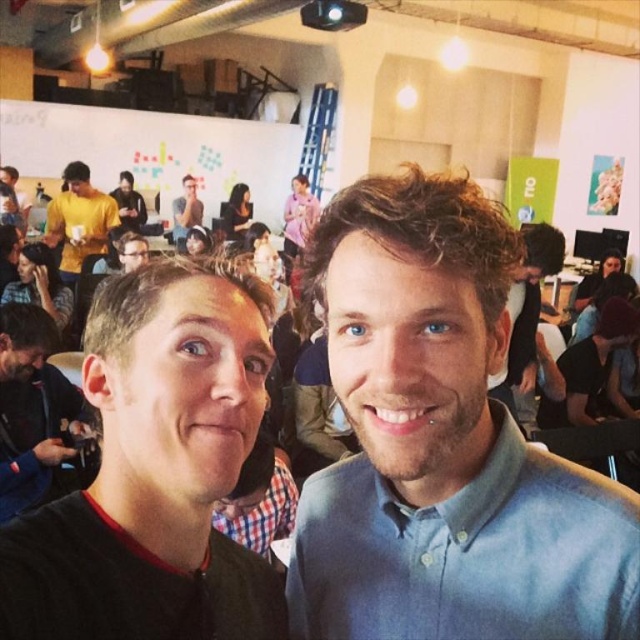
You are a photographer in the workshop and want to capture a photo of the black matte shirt at center and the matte gray shirt at upper center. Which shirt should you focus on to ensure the other is visible in the background?

You should focus on the black matte shirt at center because it is in front of the matte gray shirt at upper center, so the latter will be visible in the background.

You are organizing a photo shoot and need to place two shirts, the blue cotton shirt at center and the black matte shirt at center, on a mannequin. If you want to create a balanced look, which shirt should be placed higher on the mannequin?

The blue cotton shirt at center is larger than the black matte shirt at center, so placing the larger blue cotton shirt at center lower on the mannequin and the smaller black matte shirt at center higher would create a balanced look.